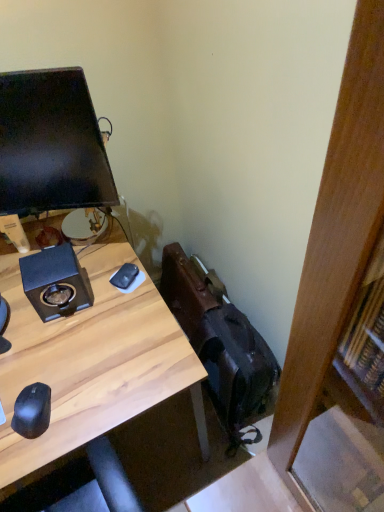
This screenshot has height=512, width=384. Identify the location of vacant space positioned to the left of black matte mouse at center, which is counted as the second mouse, starting from the bottom. (89, 290).